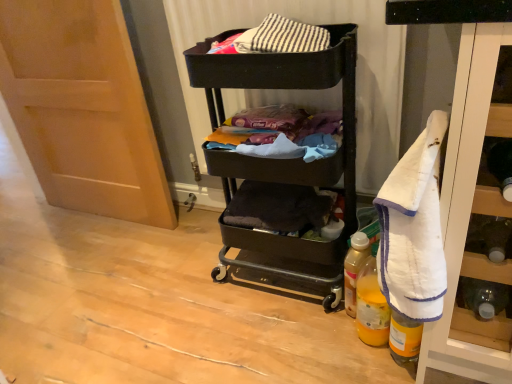
Where is `free point behind translucent yellow plastic bottle at lower right, the second bottle when ordered from back to front`? Image resolution: width=512 pixels, height=384 pixels. free point behind translucent yellow plastic bottle at lower right, the second bottle when ordered from back to front is located at coordinates (326, 307).